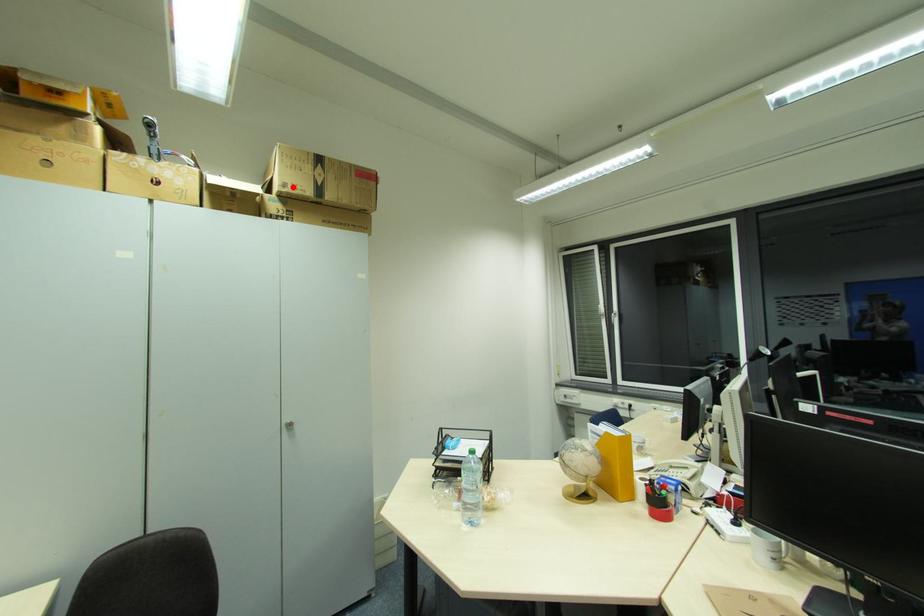
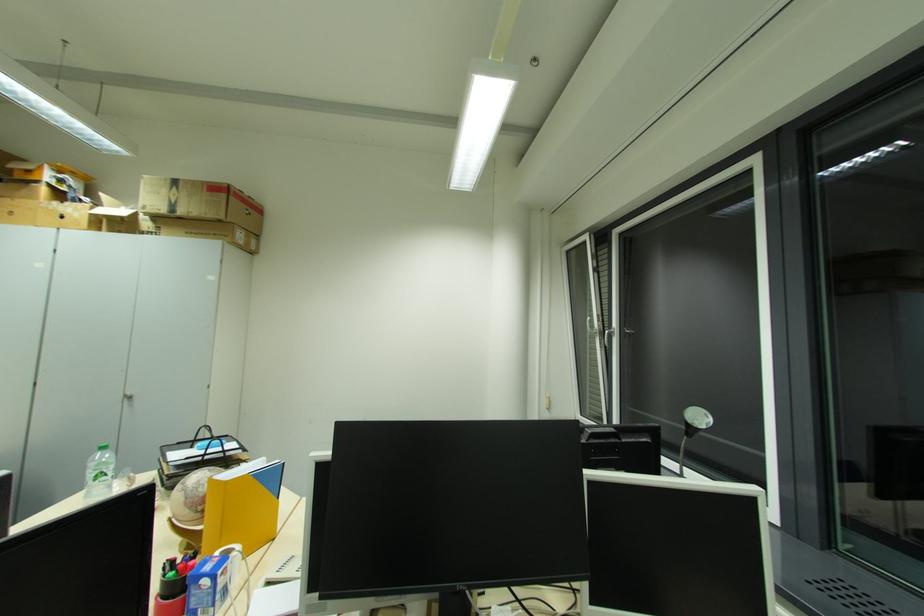
Locate, in the second image, the point that corresponds to the highlighted location in the first image.

(152, 209)